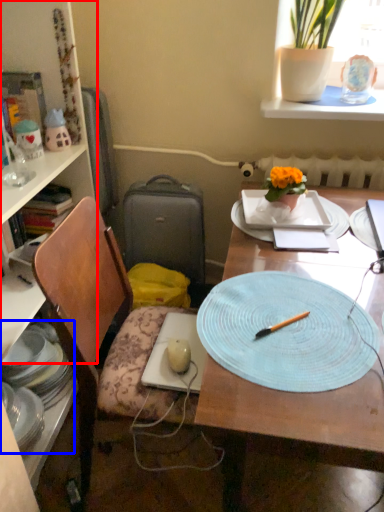
Question: Which object appears farthest to the camera in this image, bookcase (highlighted by a red box) or tableware (highlighted by a blue box)?

Choices:
 (A) bookcase
 (B) tableware

Answer: (B)